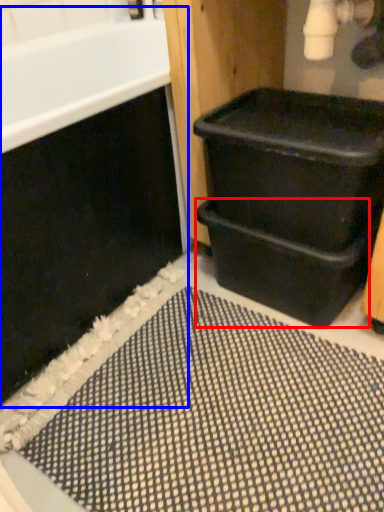
Question: Which point is closer to the camera, drawer (highlighted by a red box) or bath (highlighted by a blue box)?

Choices:
 (A) drawer
 (B) bath

Answer: (B)